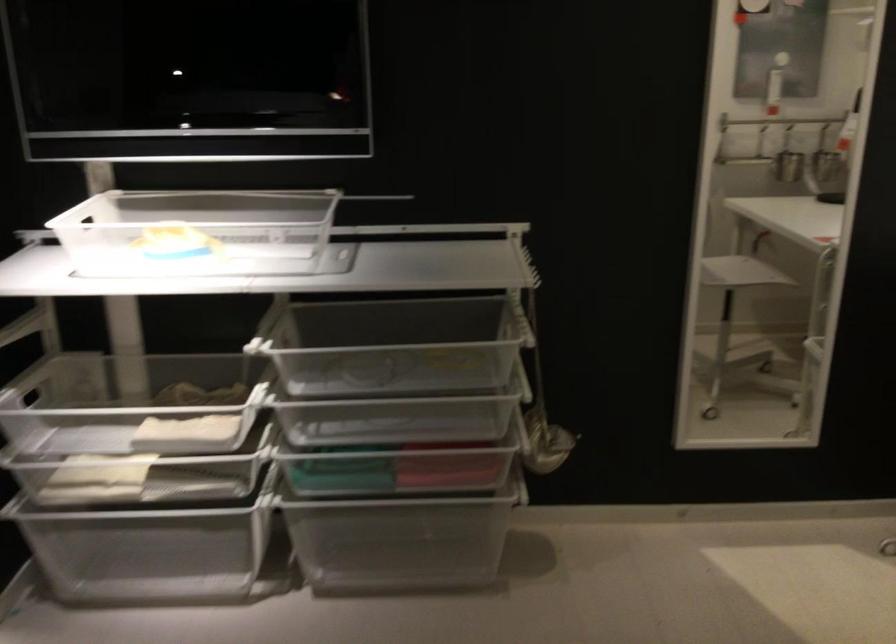
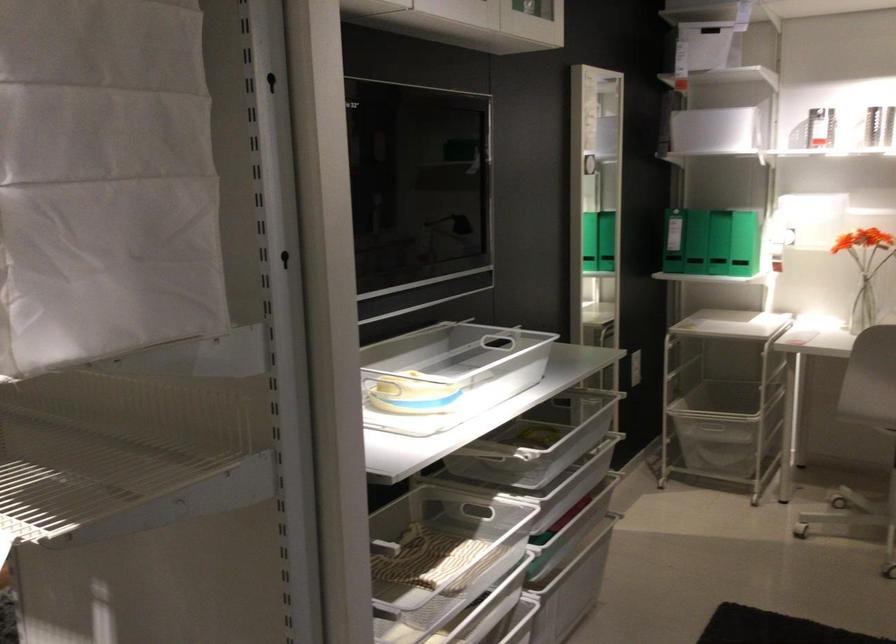
Find the pixel in the second image that matches [519,386] in the first image.

(561, 428)